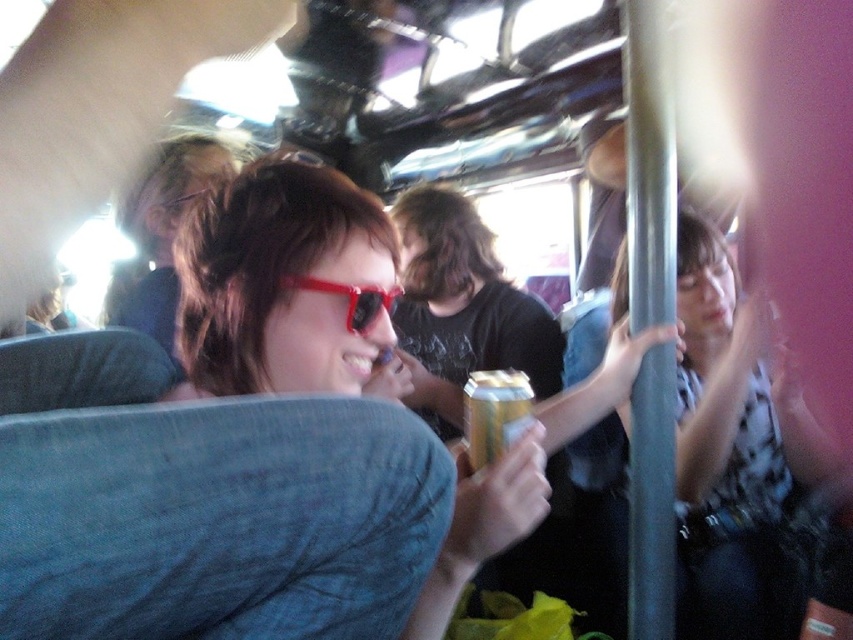
Can you confirm if gold foil can at center is bigger than transparent plastic sunglasses at center?

Correct, gold foil can at center is larger in size than transparent plastic sunglasses at center.

Identify the location of gold foil can at center. (494, 413).